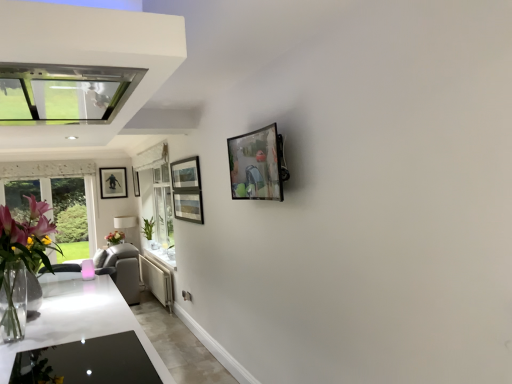
Question: Do you think clear glass vase at left is within white glossy countertop at lower left, or outside of it?

Choices:
 (A) outside
 (B) inside

Answer: (A)

Question: From their relative heights in the image, would you say clear glass vase at left is taller or shorter than white glossy countertop at lower left?

Choices:
 (A) short
 (B) tall

Answer: (B)

Question: Which of these objects is positioned farthest from the white glossy countertop at lower left?

Choices:
 (A) matte black picture frame at center, the 2th picture frame from the back
 (B) white glossy exhaust hood at upper left
 (C) matte black picture frame at left, the first picture frame in the back-to-front sequence
 (D) matte white lampshade at center
 (E) metallic glass picture frame at upper center, the third picture frame in the left-to-right sequence

Answer: (A)

Question: Which is farther from the green leafy plant at lower left?

Choices:
 (A) matte white lampshade at center
 (B) matte black picture frame at center, acting as the 2th picture frame starting from the right
 (C) metallic glass picture frame at upper center, which is the 3th picture frame in back-to-front order
 (D) white glossy exhaust hood at upper left
 (E) white glossy countertop at lower left

Answer: (C)